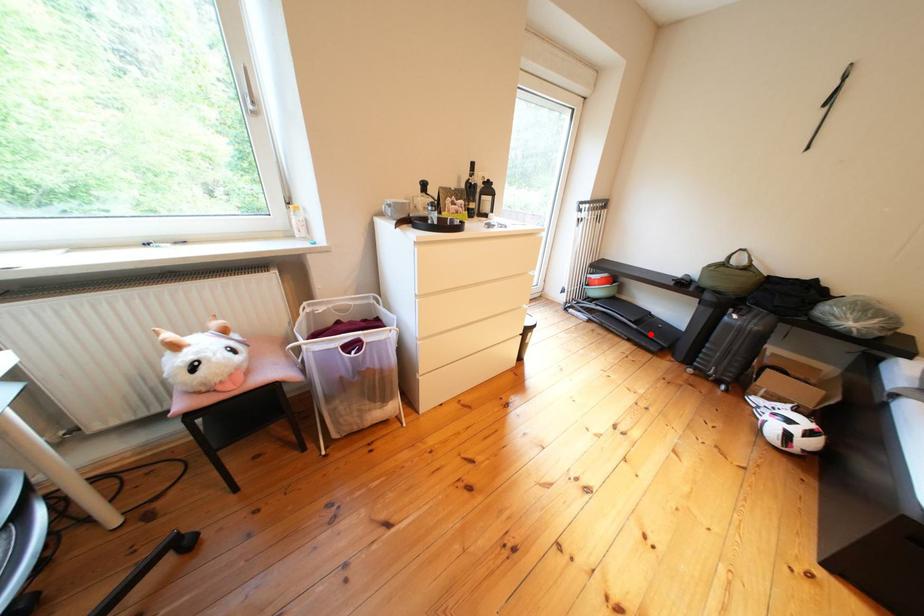
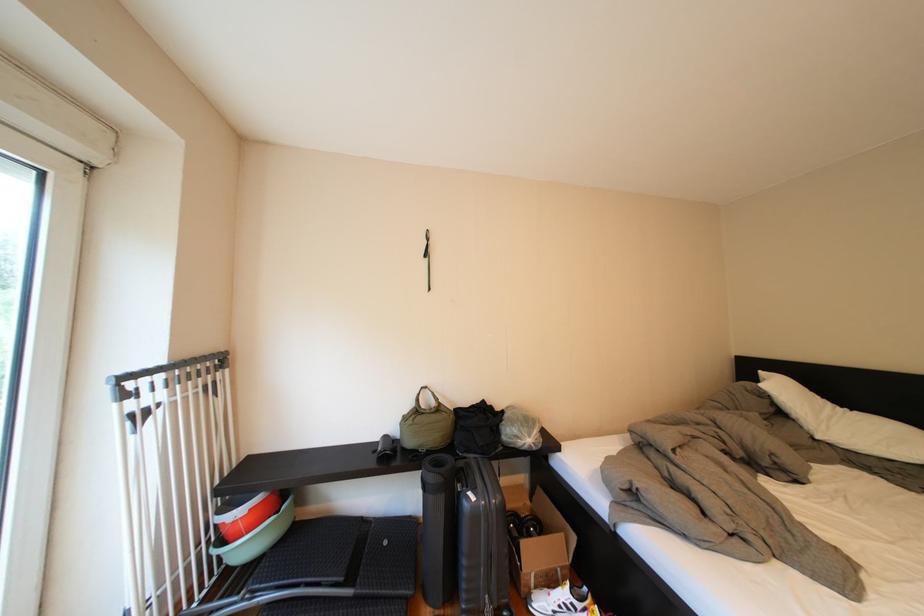
In the second image, find the point that corresponds to the highlighted location in the first image.

(370, 602)